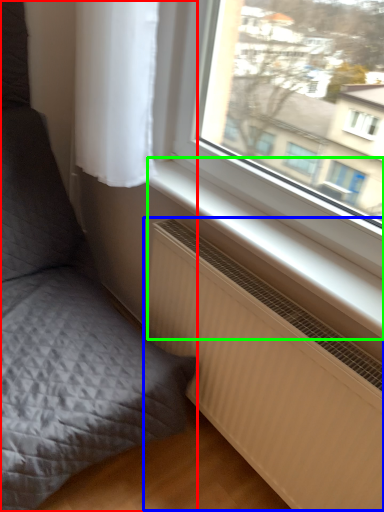
Question: Considering the real-world distances, which object is farthest from furniture (highlighted by a red box)? radiator (highlighted by a blue box) or window sill (highlighted by a green box)?

Choices:
 (A) radiator
 (B) window sill

Answer: (B)